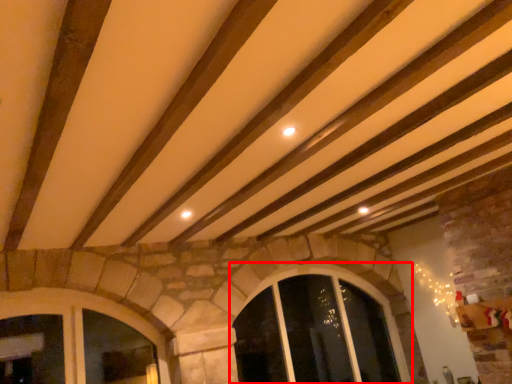
Question: From the image's perspective, what is the correct spatial relationship of window (annotated by the red box) in relation to window?

Choices:
 (A) below
 (B) above

Answer: (A)